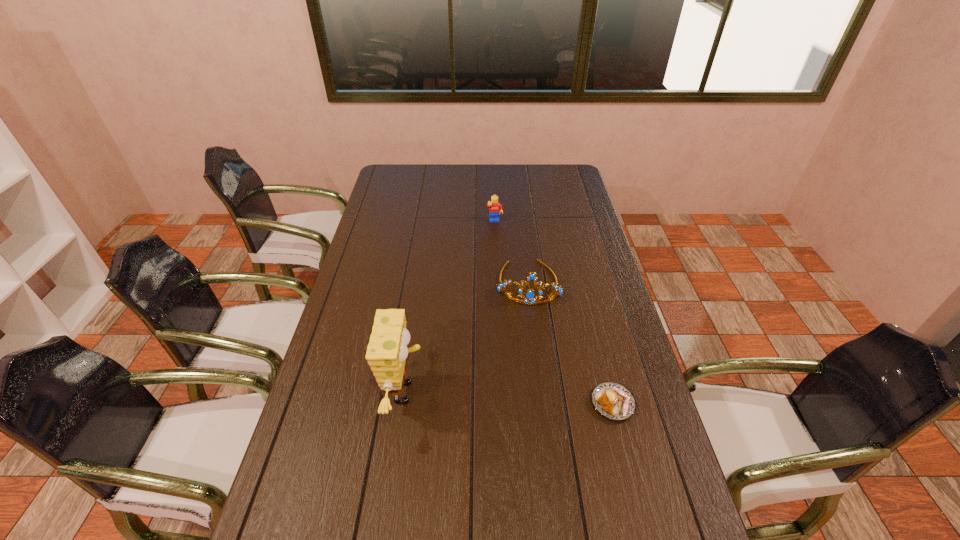
Where is `the leftmost object`? The image size is (960, 540). the leftmost object is located at coordinates (387, 351).

Find the location of `the tallest object`. the tallest object is located at coordinates (387, 351).

The height and width of the screenshot is (540, 960). What are the coordinates of `pastry` in the screenshot? It's located at 611,400.

The height and width of the screenshot is (540, 960). I want to click on the rightmost object, so click(611, 400).

I want to click on the farthest object, so click(x=494, y=206).

Find the location of a particular element. The image size is (960, 540). Lego is located at coordinates (494, 206).

In order to click on the second tallest object in this screenshot , I will do `click(530, 296)`.

Locate an element on the screen. The width and height of the screenshot is (960, 540). the second farthest object is located at coordinates (530, 296).

Image resolution: width=960 pixels, height=540 pixels. I want to click on vacant point located on the front-facing side of the tallest object, so click(x=481, y=393).

Find the location of `vacant point located on the left of the rightmost object`. vacant point located on the left of the rightmost object is located at coordinates pyautogui.click(x=466, y=403).